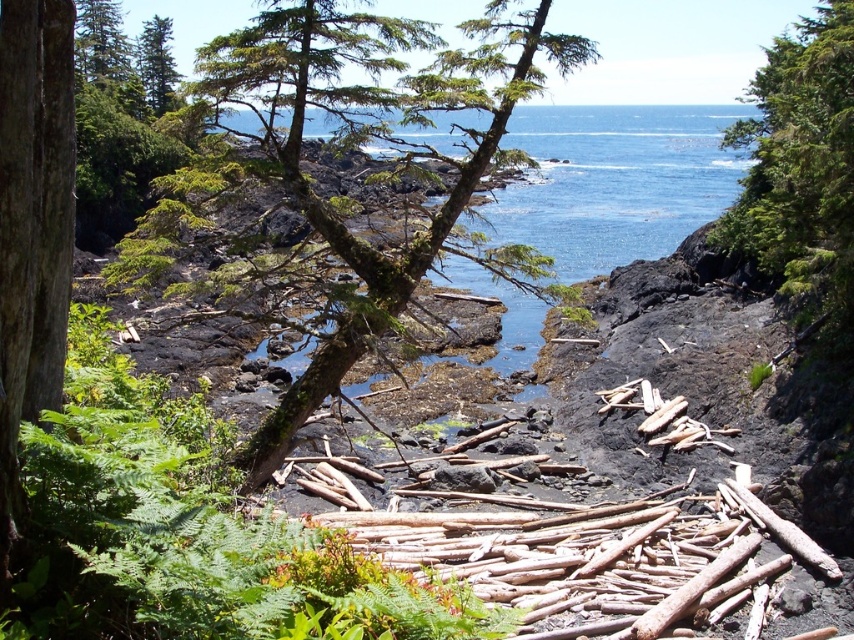
Question: Can you confirm if green mossy bark tree at center is bigger than green mossy tree at upper center?

Choices:
 (A) no
 (B) yes

Answer: (B)

Question: Observing the image, what is the correct spatial positioning of green mossy tree at upper center in reference to green rough bark tree at upper left?

Choices:
 (A) left
 (B) right

Answer: (B)

Question: Which is nearer to the green rough bark tree at upper left?

Choices:
 (A) green mossy bark tree at center
 (B) green mossy tree at upper center

Answer: (A)

Question: Among these objects, which one is nearest to the camera?

Choices:
 (A) green mossy tree at upper center
 (B) green mossy bark tree at center

Answer: (B)

Question: Which of the following is the farthest from the observer?

Choices:
 (A) green rough bark tree at upper left
 (B) green mossy tree at upper center
 (C) green mossy bark tree at center

Answer: (A)

Question: From the image, what is the correct spatial relationship of green mossy tree at upper center in relation to green rough bark tree at upper left?

Choices:
 (A) right
 (B) left

Answer: (A)